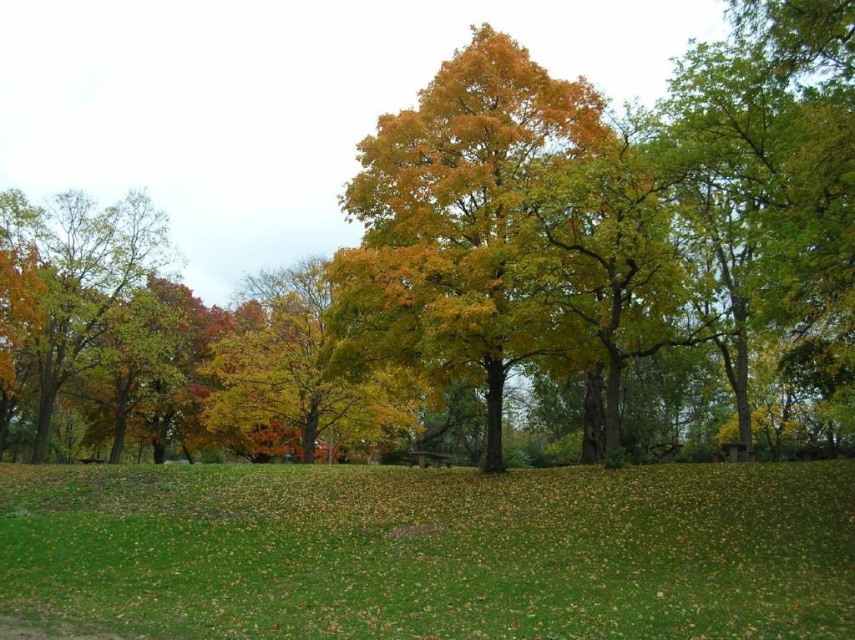
Between point (821, 488) and point (77, 300), which one is positioned in front?

Point (821, 488)

Which is more to the right, green grassy field at lower center or yellow-green foliage at left?

green grassy field at lower center

This screenshot has width=855, height=640. What do you see at coordinates (435, 552) in the screenshot? I see `green grassy field at lower center` at bounding box center [435, 552].

Locate an element on the screen. This screenshot has height=640, width=855. green grassy field at lower center is located at coordinates (435, 552).

Between point (434, 244) and point (57, 314), which one is positioned in front?

Point (434, 244)

Which is above, yellow-green foliage at center or yellow-green foliage at left?

Positioned higher is yellow-green foliage at left.

Is point (528, 84) in front of point (22, 282)?

Yes, point (528, 84) is in front of point (22, 282).

This screenshot has width=855, height=640. Find the location of `yellow-green foliage at center`. yellow-green foliage at center is located at coordinates (457, 221).

Which is above, green grassy field at lower center or yellow-green foliage at center?

yellow-green foliage at center is higher up.

Does point (411, 598) come in front of point (472, 45)?

Yes, point (411, 598) is closer to viewer.

Describe the element at coordinates (435, 552) in the screenshot. This screenshot has height=640, width=855. I see `green grassy field at lower center` at that location.

The width and height of the screenshot is (855, 640). I want to click on green grassy field at lower center, so click(435, 552).